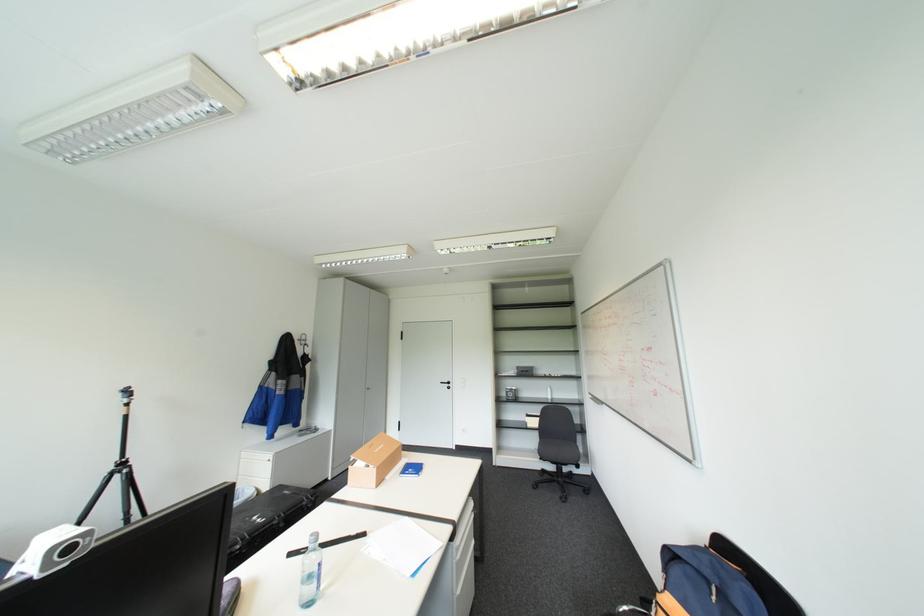
Where would you lift the small cardboard box? Please return your answer as a coordinate pair (x, y).

(373, 461)